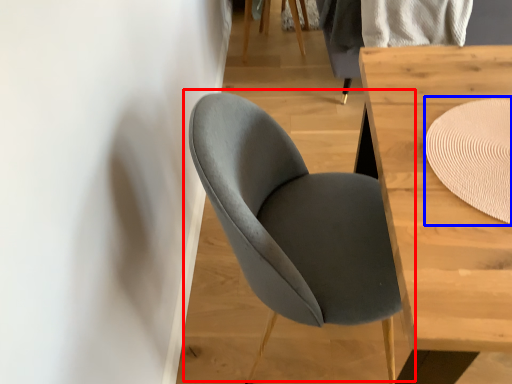
Question: Which of the following is the farthest to the observer, chair (highlighted by a red box) or mat (highlighted by a blue box)?

Choices:
 (A) chair
 (B) mat

Answer: (B)